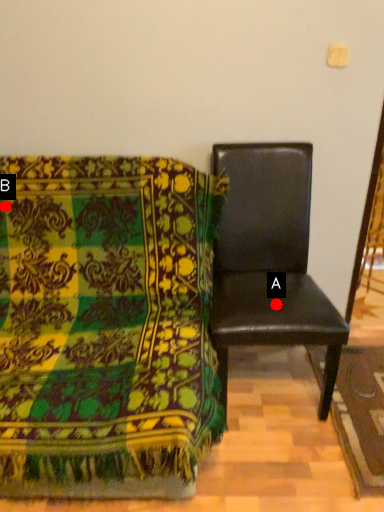
Question: Two points are circled on the image, labeled by A and B beside each circle. Which point is closer to the camera?

Choices:
 (A) A is closer
 (B) B is closer

Answer: (A)